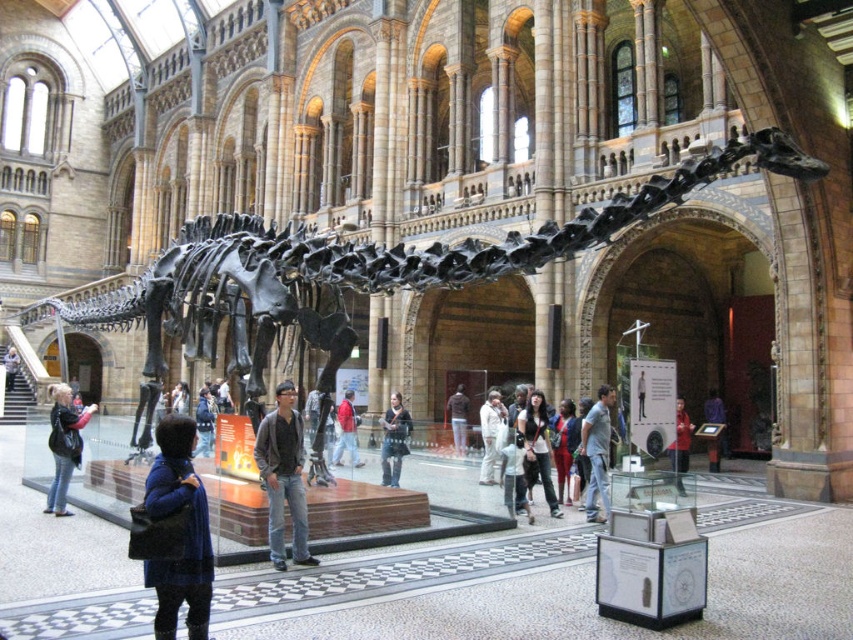
Question: Is dark blue jeans at center thinner than light blue jeans at center?

Choices:
 (A) yes
 (B) no

Answer: (B)

Question: Observing the image, what is the correct spatial positioning of dark brown leather jacket at center in reference to dark gray sweater at center?

Choices:
 (A) below
 (B) above

Answer: (B)

Question: Among these points, which one is nearest to the camera?

Choices:
 (A) (561, 413)
 (B) (540, 474)
 (C) (70, 442)

Answer: (C)

Question: Among these objects, which one is farthest from the camera?

Choices:
 (A) white matte suit at center
 (B) denim jacket at center
 (C) dark blue jacket at center

Answer: (C)

Question: Does dark gray jeans at center have a lesser width compared to red fabric jacket at center?

Choices:
 (A) no
 (B) yes

Answer: (B)

Question: Which point is closer to the camera taking this photo?

Choices:
 (A) (387, 449)
 (B) (676, 442)

Answer: (A)